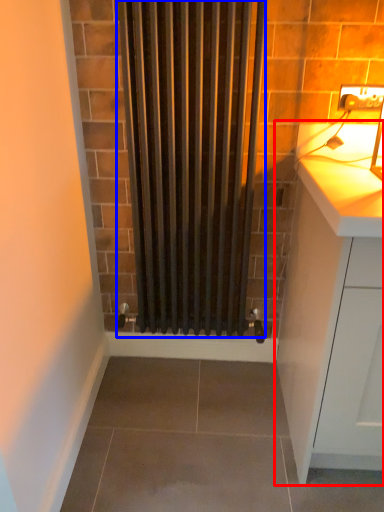
Question: Which object appears closest to the camera in this image, cabinetry (highlighted by a red box) or shower curtain (highlighted by a blue box)?

Choices:
 (A) cabinetry
 (B) shower curtain

Answer: (A)